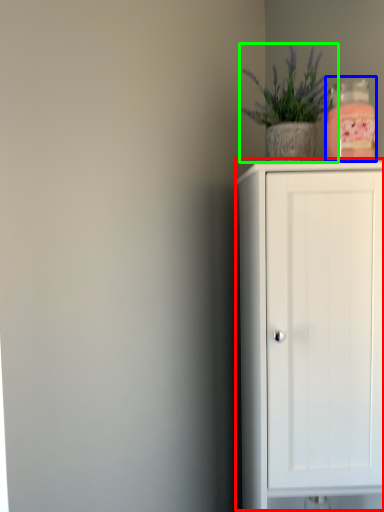
Question: Estimate the real-world distances between objects in this image. Which object is closer to cupboard (highlighted by a red box), bottle (highlighted by a blue box) or houseplant (highlighted by a green box)?

Choices:
 (A) bottle
 (B) houseplant

Answer: (A)